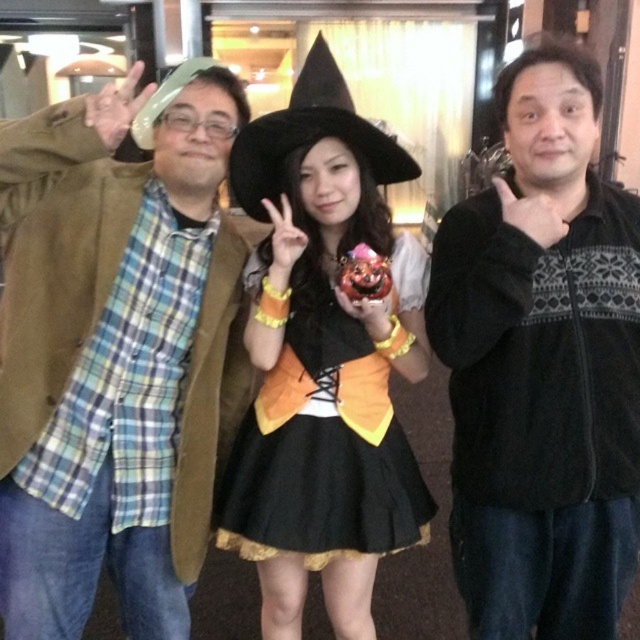
Question: Is brown suede jacket at left thinner than black satin dress at center?

Choices:
 (A) yes
 (B) no

Answer: (B)

Question: Which point appears closest to the camera in this image?

Choices:
 (A) (532, 481)
 (B) (182, 465)

Answer: (A)

Question: Which point is farther to the camera?

Choices:
 (A) (104, 243)
 (B) (305, 563)

Answer: (B)

Question: Can you confirm if black velvety jacket at center is positioned below black satin dress at center?

Choices:
 (A) yes
 (B) no

Answer: (B)

Question: Is black velvety jacket at center to the left of black satin dress at center from the viewer's perspective?

Choices:
 (A) yes
 (B) no

Answer: (B)

Question: Which of the following is the closest to the observer?

Choices:
 (A) black satin dress at center
 (B) brown suede jacket at left
 (C) black velvety jacket at center

Answer: (B)